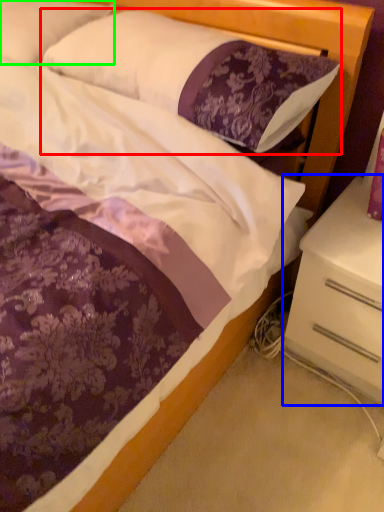
Question: Based on their relative distances, which object is farther from pillow (highlighted by a red box)? Choose from nightstand (highlighted by a blue box) and pillow (highlighted by a green box).

Choices:
 (A) nightstand
 (B) pillow

Answer: (A)